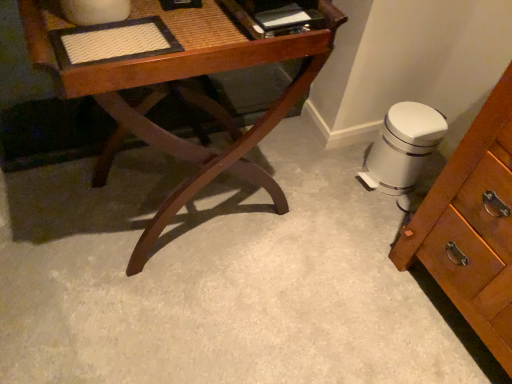
This screenshot has height=384, width=512. What do you see at coordinates (403, 147) in the screenshot? I see `white glossy trash can at lower right` at bounding box center [403, 147].

Find the location of a particular element. white glossy trash can at lower right is located at coordinates (403, 147).

What do you see at coordinates (178, 79) in the screenshot? I see `glossy wood desk at center` at bounding box center [178, 79].

In order to click on glossy wood desk at center in this screenshot , I will do 178,79.

What is the approximate height of glossy wood desk at center?

The height of glossy wood desk at center is 72.99 centimeters.

The image size is (512, 384). In order to click on white glossy trash can at lower right in this screenshot , I will do `click(403, 147)`.

Is white glossy trash can at lower right to the left or to the right of glossy wood desk at center in the image?

From the image, it's evident that white glossy trash can at lower right is to the right of glossy wood desk at center.

Which is in front, white glossy trash can at lower right or glossy wood desk at center?

glossy wood desk at center is more forward.

Which is farther from the camera, [397,157] or [56,59]?

The point [397,157] is more distant.

From the image's perspective, is white glossy trash can at lower right above or below glossy wood desk at center?

From the image's perspective, white glossy trash can at lower right appears below glossy wood desk at center.

From a real-world perspective, which object rests below the other?

From a 3D spatial view, white glossy trash can at lower right is below.

Is white glossy trash can at lower right wider or thinner than glossy wood desk at center?

Considering their sizes, white glossy trash can at lower right looks slimmer than glossy wood desk at center.

Which of these two, white glossy trash can at lower right or glossy wood desk at center, stands taller?

With more height is glossy wood desk at center.

Does white glossy trash can at lower right have a larger size compared to glossy wood desk at center?

No.

Would you say white glossy trash can at lower right is inside or outside glossy wood desk at center?

white glossy trash can at lower right cannot be found inside glossy wood desk at center.

Is white glossy trash can at lower right far away from glossy wood desk at center?

No, white glossy trash can at lower right is not far from glossy wood desk at center.

Is white glossy trash can at lower right oriented towards glossy wood desk at center?

Yes, white glossy trash can at lower right faces towards glossy wood desk at center.

This screenshot has width=512, height=384. In the image, there is a white glossy trash can at lower right. Find the location of `desk above it (from the image's perspective)`. desk above it (from the image's perspective) is located at coordinates (178, 79).

Which is more to the left, glossy wood desk at center or white glossy trash can at lower right?

glossy wood desk at center.

Who is more distant, glossy wood desk at center or white glossy trash can at lower right?

white glossy trash can at lower right is behind.

Is point (154, 68) behind point (376, 149)?

No, it is not.

From the image's perspective, who appears lower, glossy wood desk at center or white glossy trash can at lower right?

white glossy trash can at lower right.

Consider the image. From a real-world perspective, which is physically below, glossy wood desk at center or white glossy trash can at lower right?

white glossy trash can at lower right is physically lower.

Between glossy wood desk at center and white glossy trash can at lower right, which one has larger width?

Wider between the two is glossy wood desk at center.

Does glossy wood desk at center have a lesser height compared to white glossy trash can at lower right?

Incorrect, the height of glossy wood desk at center does not fall short of that of white glossy trash can at lower right.

Considering the sizes of objects glossy wood desk at center and white glossy trash can at lower right in the image provided, who is smaller, glossy wood desk at center or white glossy trash can at lower right?

white glossy trash can at lower right.

Is glossy wood desk at center completely or partially outside of white glossy trash can at lower right?

Indeed, glossy wood desk at center is completely outside white glossy trash can at lower right.

Would you consider glossy wood desk at center to be distant from white glossy trash can at lower right?

No, glossy wood desk at center is not far from white glossy trash can at lower right.

Does glossy wood desk at center turn towards white glossy trash can at lower right?

No, glossy wood desk at center is not facing towards white glossy trash can at lower right.

How different are the orientations of glossy wood desk at center and white glossy trash can at lower right in degrees?

The angular difference between glossy wood desk at center and white glossy trash can at lower right is 94.1 degrees.

What are the coordinates of `swivel chair located behind the glossy wood desk at center` in the screenshot? It's located at (403, 147).

The height and width of the screenshot is (384, 512). Find the location of `desk that appears on the left of white glossy trash can at lower right`. desk that appears on the left of white glossy trash can at lower right is located at coordinates (178, 79).

This screenshot has width=512, height=384. What are the coordinates of `desk that appears in front of the white glossy trash can at lower right` in the screenshot? It's located at (178, 79).